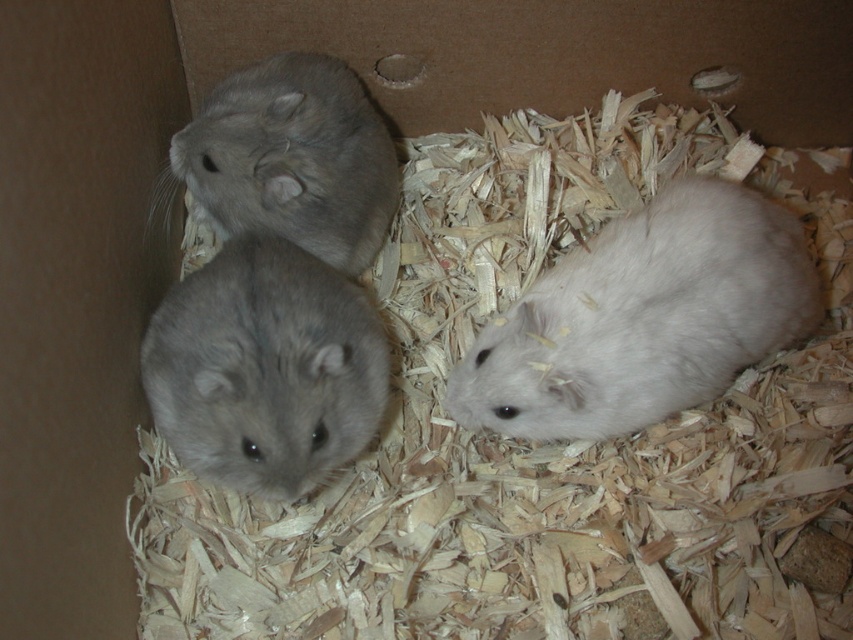
You are a veterinarian observing the hamsters in the cardboard box. You need to check the gray soft fur hamster at upper left first. Which direction should you move your hand from the gray soft fur hamster at center to reach it?

To reach the gray soft fur hamster at upper left from the gray soft fur hamster at center, you should move your hand to the right since the gray soft fur hamster at center is located to the left of the gray soft fur hamster at upper left.

You are a veterinarian examining a cardboard box with hamsters. You need to locate the white fluffy hamster at right. Where exactly is it located in the box?

The white fluffy hamster at right is located at point (x=643, y=317) in the box.